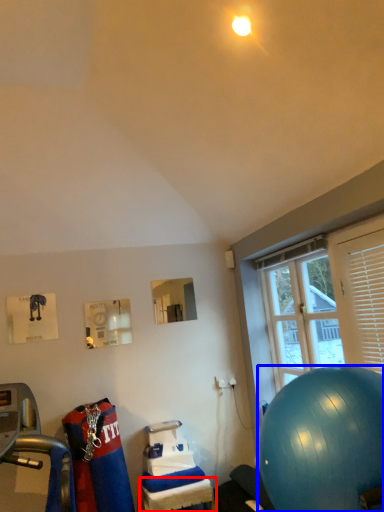
Question: Which of the following is the closest to the observer, table (highlighted by a red box) or ball (highlighted by a blue box)?

Choices:
 (A) table
 (B) ball

Answer: (B)